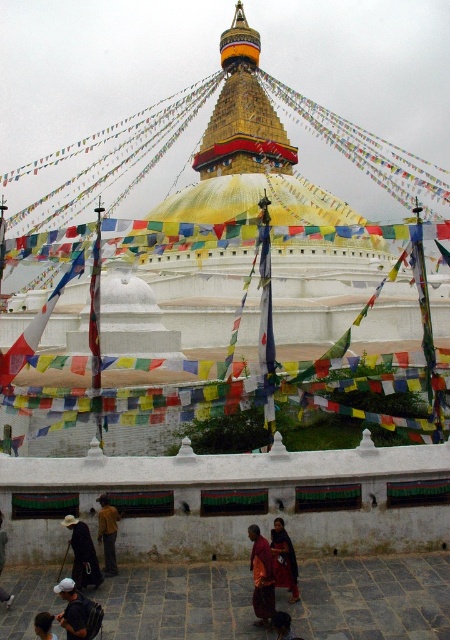
Question: Among these points, which one is nearest to the camera?

Choices:
 (A) (0, 595)
 (B) (90, 612)
 (C) (84, 573)
 (D) (36, 632)

Answer: (D)

Question: Does dark brown fabric at lower left come behind red fabric dress at center?

Choices:
 (A) yes
 (B) no

Answer: (A)

Question: Does dark gray backpack at lower left appear on the left side of dark brown hair at lower center?

Choices:
 (A) yes
 (B) no

Answer: (B)

Question: Which object is the closest to the dark brown leather jacket at lower left?

Choices:
 (A) yellow fabric jacket at lower left
 (B) dark red robe at center
 (C) dark brown fabric at lower left

Answer: (C)

Question: Can you confirm if dark brown fabric at lower left is positioned above dark brown leather jacket at lower center?

Choices:
 (A) no
 (B) yes

Answer: (B)

Question: Based on their relative distances, which object is farther from the dark brown hair at lower center?

Choices:
 (A) dark brown leather jacket at lower left
 (B) gold/yellow/golden metallic spire at center
 (C) red fabric dress at center

Answer: (B)